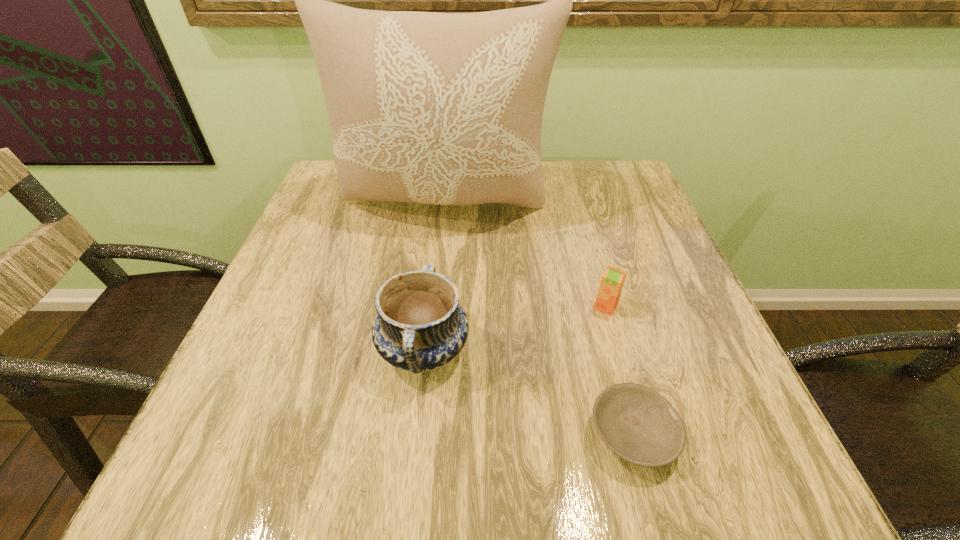
The image size is (960, 540). Find the location of `the tallest object`. the tallest object is located at coordinates (437, 108).

Find the location of a particular element. This screenshot has width=960, height=540. cushion is located at coordinates (437, 108).

This screenshot has height=540, width=960. I want to click on the third shortest object, so click(420, 326).

This screenshot has height=540, width=960. I want to click on orange juice, so click(x=612, y=281).

The image size is (960, 540). I want to click on bowl, so click(635, 422).

Locate an element on the screen. vacant region located 0.350m on the front side of the tallest object is located at coordinates (429, 362).

Identify the location of vacant space located on the left of the second tallest object. (242, 350).

At what (x,y) coordinates should I click in order to perform the action: click on free point located on the front of the second shortest object. Please return your answer as a coordinate pair (x, y). Image resolution: width=960 pixels, height=540 pixels. Looking at the image, I should click on (623, 369).

Locate an element on the screen. vacant area located 0.270m on the back of the shortest object is located at coordinates (591, 281).

Identify the location of object positioned at the far edge. This screenshot has height=540, width=960. (437, 108).